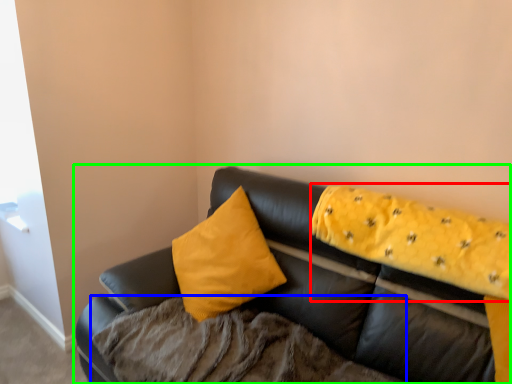
Question: Which object is the farthest from blanket (highlighted by a red box)? Choose among these: bedding (highlighted by a blue box) or studio couch (highlighted by a green box).

Choices:
 (A) bedding
 (B) studio couch

Answer: (A)